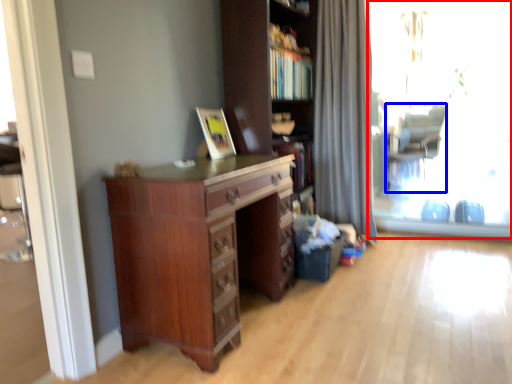
Question: Which object is closer to the camera taking this photo, window screen (highlighted by a red box) or swivel chair (highlighted by a blue box)?

Choices:
 (A) window screen
 (B) swivel chair

Answer: (A)